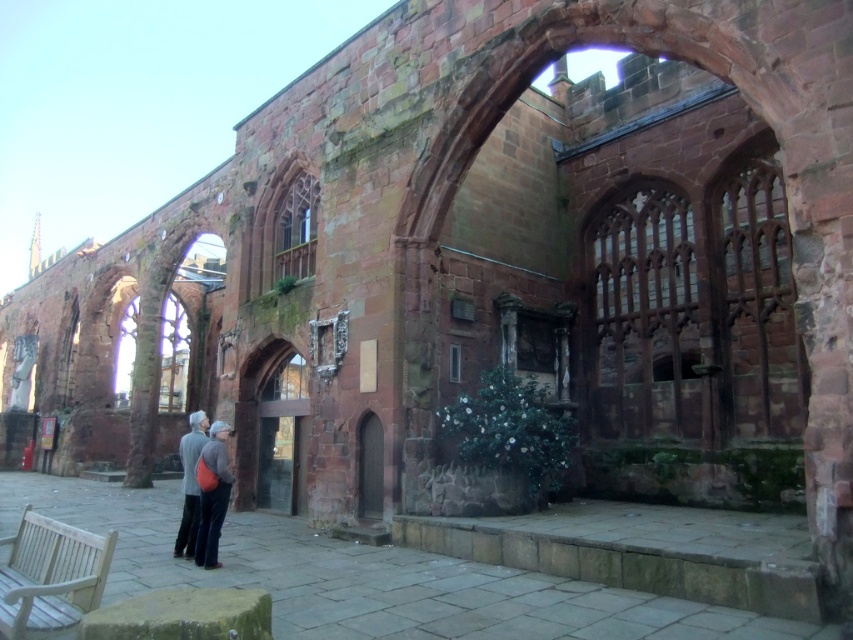
Is white wooden bench at lower left to the left of matte orange backpack at lower left from the viewer's perspective?

Correct, you'll find white wooden bench at lower left to the left of matte orange backpack at lower left.

Between point (10, 614) and point (204, 529), which one is positioned in front?

Positioned in front is point (10, 614).

This screenshot has height=640, width=853. What are the coordinates of `white wooden bench at lower left` in the screenshot? It's located at (50, 577).

Between matte orange backpack at lower left and gray fabric jacket at center, which one has less height?

With less height is matte orange backpack at lower left.

Is matte orange backpack at lower left below gray fabric jacket at center?

No, matte orange backpack at lower left is not below gray fabric jacket at center.

Find the location of a particular element. This screenshot has height=640, width=853. matte orange backpack at lower left is located at coordinates (212, 493).

The image size is (853, 640). What do you see at coordinates (50, 577) in the screenshot? I see `white wooden bench at lower left` at bounding box center [50, 577].

This screenshot has width=853, height=640. Identify the location of white wooden bench at lower left. (50, 577).

Between point (22, 556) and point (184, 531), which one is positioned behind?

The point (184, 531) is more distant.

What are the coordinates of `white wooden bench at lower left` in the screenshot? It's located at (50, 577).